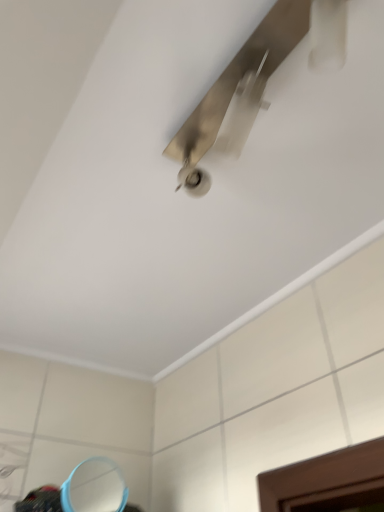
Question: Is point (115, 474) closer or farther from the camera than point (221, 93)?

Choices:
 (A) farther
 (B) closer

Answer: (A)

Question: Which is correct: blue plastic mirror at lower left is inside metallic silver ceiling fan at upper center, or outside of it?

Choices:
 (A) outside
 (B) inside

Answer: (A)

Question: Looking at the image, does blue plastic mirror at lower left seem bigger or smaller compared to metallic silver ceiling fan at upper center?

Choices:
 (A) big
 (B) small

Answer: (B)

Question: From a real-world perspective, relative to blue plastic mirror at lower left, is metallic silver ceiling fan at upper center vertically above or below?

Choices:
 (A) above
 (B) below

Answer: (A)

Question: In the image, is metallic silver ceiling fan at upper center on the left side or the right side of blue plastic mirror at lower left?

Choices:
 (A) right
 (B) left

Answer: (A)

Question: Is point (249, 79) closer or farther from the camera than point (69, 505)?

Choices:
 (A) closer
 (B) farther

Answer: (A)

Question: In terms of width, does metallic silver ceiling fan at upper center look wider or thinner when compared to blue plastic mirror at lower left?

Choices:
 (A) thin
 (B) wide

Answer: (B)